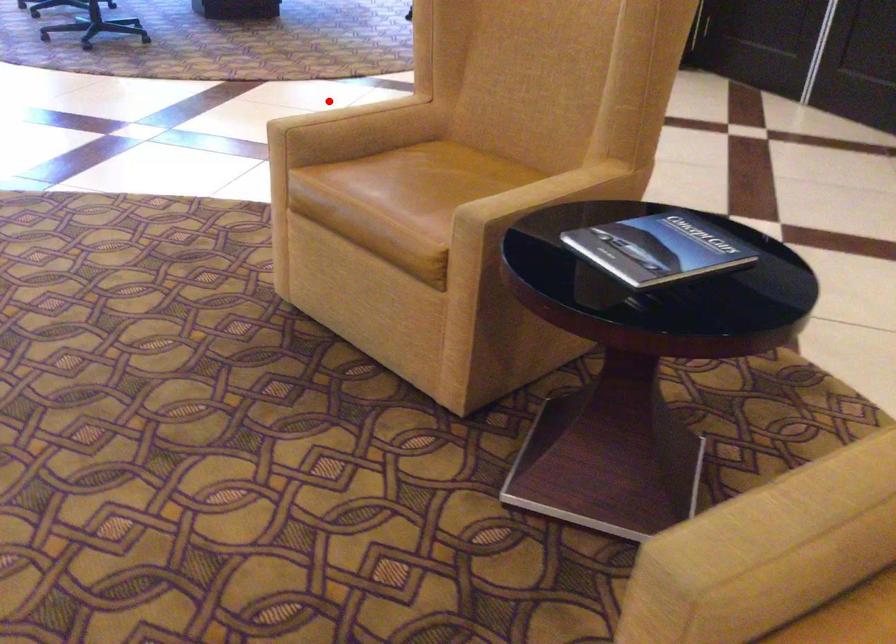
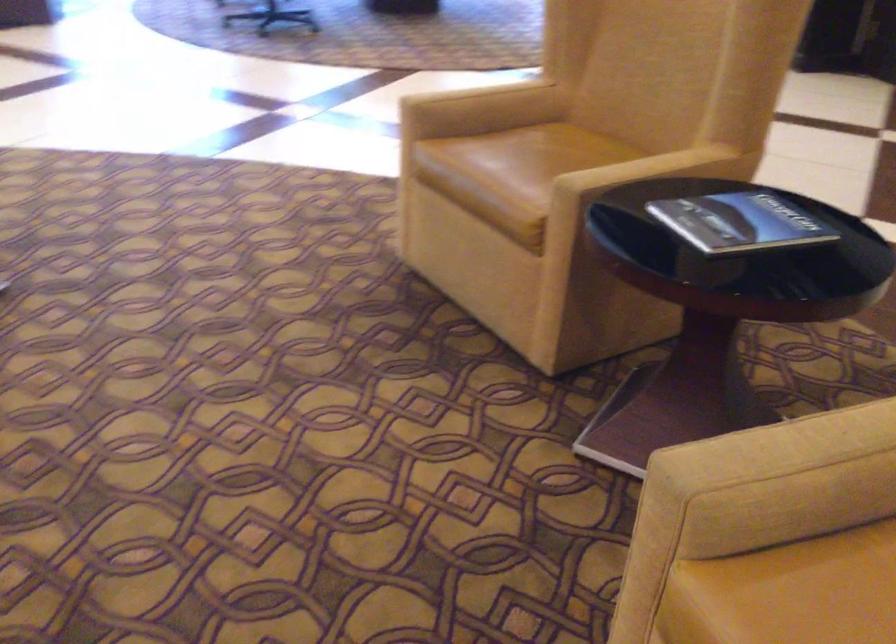
Question: A red point is marked in image1. In image2, is the corresponding 3D point closer to the camera or farther? Reply with the corresponding letter.

Choices:
 (A) The corresponding 3D point is closer.
 (B) The corresponding 3D point is farther.

Answer: (A)